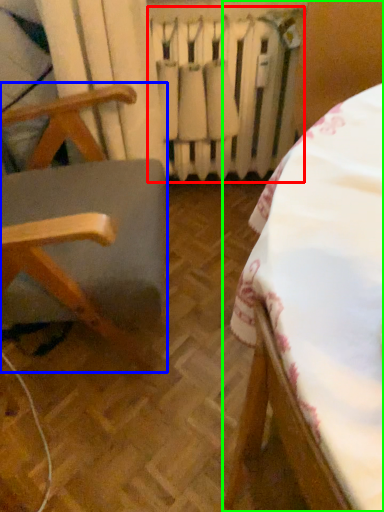
Question: Estimate the real-world distances between objects in this image. Which object is closer to radiator (highlighted by a red box), furniture (highlighted by a blue box) or furniture (highlighted by a green box)?

Choices:
 (A) furniture
 (B) furniture

Answer: (A)